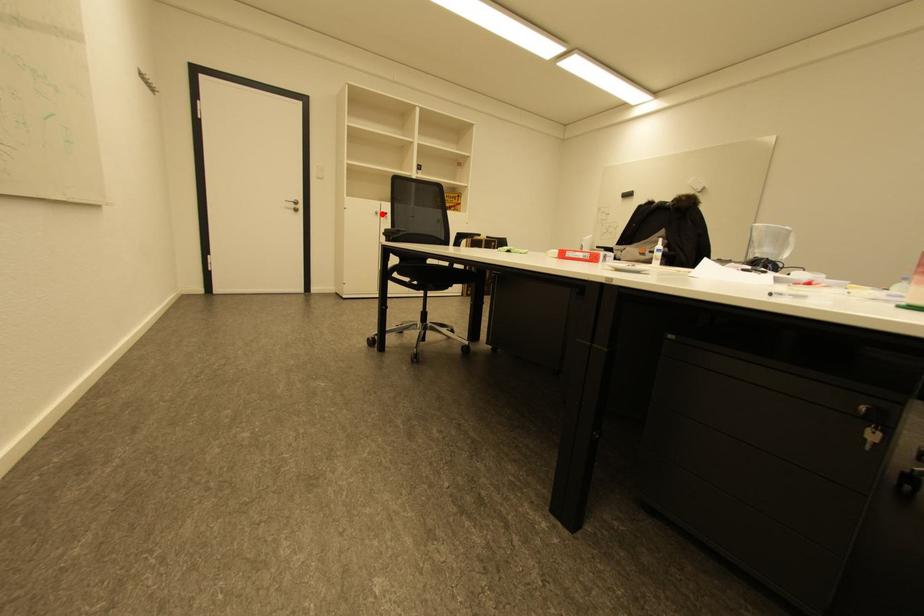
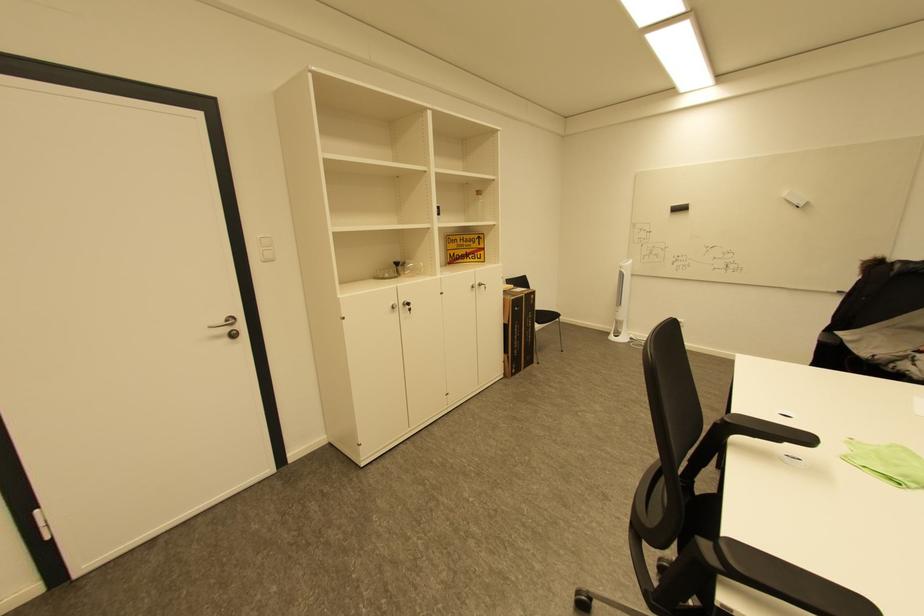
In the second image, find the point that corresponds to the highlighted location in the first image.

(398, 308)